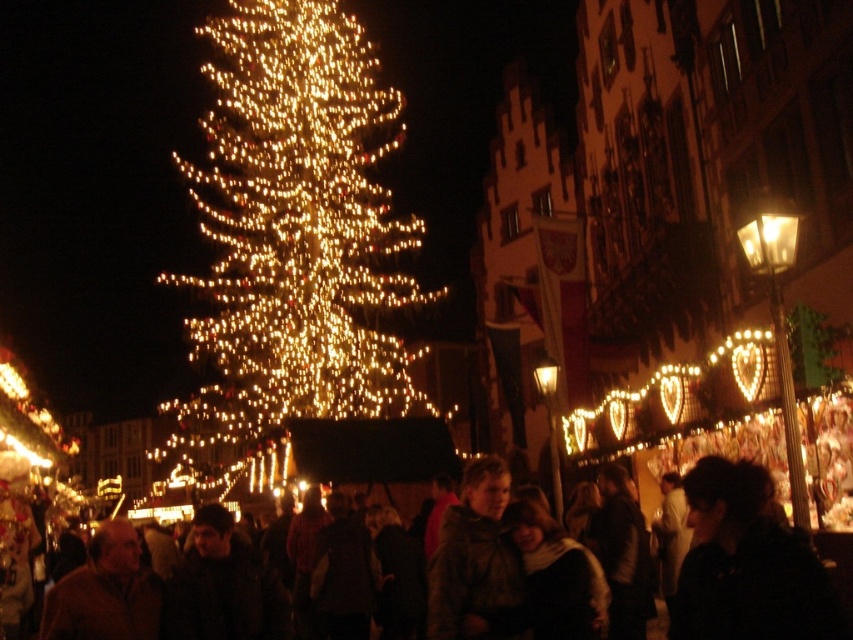
Question: Among these objects, which one is nearest to the camera?

Choices:
 (A) dark brown leather jacket at lower center
 (B) illuminated plastic tree at center
 (C) brown fuzzy coat at center
 (D) brown leather jacket at lower left

Answer: (A)

Question: Is illuminated plastic tree at center further to camera compared to brown leather jacket at lower left?

Choices:
 (A) no
 (B) yes

Answer: (B)

Question: Estimate the real-world distances between objects in this image. Which object is closer to the brown fuzzy coat at center?

Choices:
 (A) illuminated plastic tree at center
 (B) dark brown leather jacket at lower center
 (C) dark brown leather jacket at lower right
 (D) brown leather jacket at lower left

Answer: (B)

Question: From the image, what is the correct spatial relationship of brown fuzzy coat at center in relation to brown leather jacket at lower left?

Choices:
 (A) left
 (B) right

Answer: (B)

Question: Does dark brown leather jacket at lower right have a greater width compared to brown fuzzy coat at center?

Choices:
 (A) no
 (B) yes

Answer: (B)

Question: Which of the following is the closest to the observer?

Choices:
 (A) (724, 586)
 (B) (671, 632)

Answer: (A)